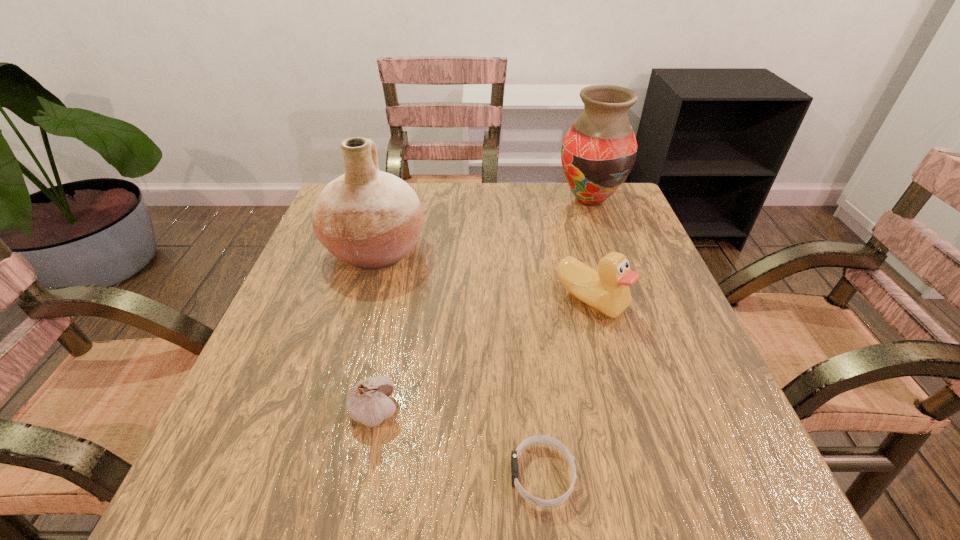
Locate an element on the screen. The width and height of the screenshot is (960, 540). the farthest object is located at coordinates (598, 152).

Where is `pottery`? The image size is (960, 540). pottery is located at coordinates (370, 219).

Find the location of a particular element. duck is located at coordinates (607, 290).

You are a GUI agent. You are given a task and a screenshot of the screen. Output one action in this format:
    pyautogui.click(x=<x>, y=<y>)
    Task: Click on the fourth farthest object
    
    Given the screenshot: What is the action you would take?
    pyautogui.click(x=368, y=402)

Locate an element on the screen. the second shortest object is located at coordinates (368, 402).

Where is `the nearest object`? the nearest object is located at coordinates (544, 439).

The width and height of the screenshot is (960, 540). I want to click on wristband, so click(544, 439).

The width and height of the screenshot is (960, 540). In order to click on vacant space located on the left of the vase in this screenshot , I will do `click(422, 200)`.

The width and height of the screenshot is (960, 540). What are the coordinates of `vacant space situated 0.170m to pour from the handle of the pottery` in the screenshot? It's located at pyautogui.click(x=500, y=250).

The image size is (960, 540). What are the coordinates of `free space located 0.090m at the beak of the duck` in the screenshot? It's located at (609, 363).